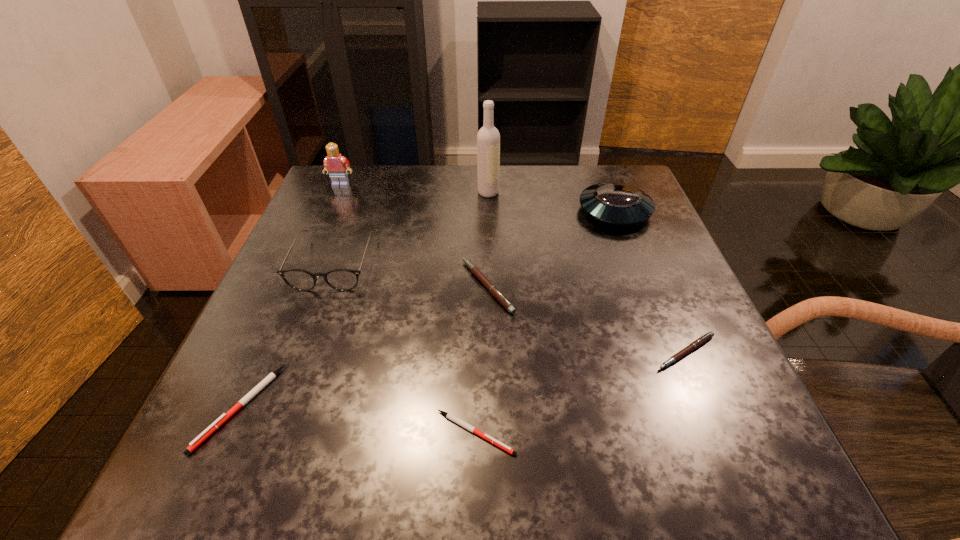
Image resolution: width=960 pixels, height=540 pixels. Find the location of `the left white pen`. the left white pen is located at coordinates (224, 417).

Identify the location of the smaller white pen. (453, 418).

Where is `the right white pen`? the right white pen is located at coordinates (453, 418).

Locate an element on the screen. The height and width of the screenshot is (540, 960). vacant space located on the back of the white vodka is located at coordinates (488, 165).

This screenshot has width=960, height=540. I want to click on free space located on the front-facing side of the second tallest object, so click(299, 282).

At what (x,y) coordinates should I click in order to perform the action: click on free location located on the left of the saucer. Please return your answer as a coordinate pair (x, y). The image size is (960, 540). Looking at the image, I should click on (532, 211).

Find the location of a particular element. This screenshot has width=960, height=540. vacant region located 0.280m through the lenses of the black spectacles is located at coordinates (275, 427).

At what (x,y) coordinates should I click in order to perform the action: click on vacant space located at the nib of the left pink pen. Please return your answer as a coordinate pair (x, y). Image resolution: width=960 pixels, height=540 pixels. Looking at the image, I should click on (436, 286).

At what (x,y) coordinates should I click in order to perform the action: click on free region located 0.230m at the nib of the left pink pen. Please return your answer as a coordinate pair (x, y). Looking at the image, I should click on (344, 286).

Where is `blank space located at the nib of the left pink pen`? Image resolution: width=960 pixels, height=540 pixels. blank space located at the nib of the left pink pen is located at coordinates (374, 286).